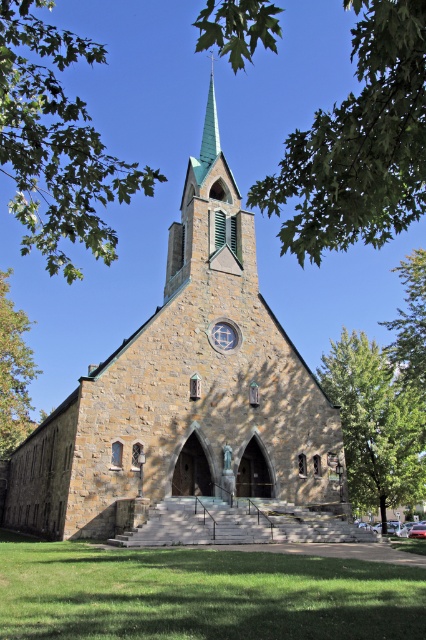
You are standing at a certain distance from the brown stone church at center. If you want to take a photo of the church with your camera, which is 1.5 meters in front of you, will the church be in focus if your camera has a maximum focusing distance of 50 meters?

The brown stone church at center and camera are 51.28 meters apart from each other. Since the camera has a maximum focusing distance of 50 meters, the church will be out of focus because it is beyond the camera lens capability.

You are standing at the coordinates point 0.5, 0.5 in the image. You want to walk towards the brown stone church at center. In which direction should you move?

Since the brown stone church at center is located at point (186, 397) and you are at point (213, 320), you should move northeast to reach it.

You are standing in front of the church and notice two green leafy trees. One is labeled as the green leafy tree at upper center and the other as the green leafy tree at right. From your perspective, which tree is positioned to the left of the other?

The green leafy tree at upper center is to the left of the green leafy tree at right.